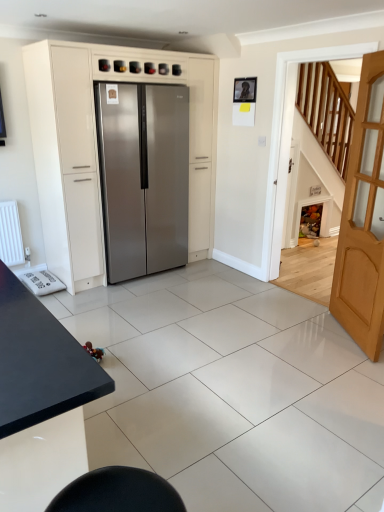
Question: From a real-world perspective, is stainless steel refrigerator at center beneath satin silver refrigerator at center?

Choices:
 (A) yes
 (B) no

Answer: (A)

Question: Could you tell me if stainless steel refrigerator at center is facing satin silver refrigerator at center?

Choices:
 (A) no
 (B) yes

Answer: (B)

Question: Can you confirm if stainless steel refrigerator at center is shorter than satin silver refrigerator at center?

Choices:
 (A) yes
 (B) no

Answer: (A)

Question: Does stainless steel refrigerator at center have a greater width compared to satin silver refrigerator at center?

Choices:
 (A) no
 (B) yes

Answer: (B)

Question: Does stainless steel refrigerator at center come behind satin silver refrigerator at center?

Choices:
 (A) no
 (B) yes

Answer: (B)

Question: Would you say stainless steel refrigerator at center is outside satin silver refrigerator at center?

Choices:
 (A) yes
 (B) no

Answer: (B)

Question: Is satin silver refrigerator at center not within light brown wooden door at right?

Choices:
 (A) no
 (B) yes

Answer: (B)

Question: Could you tell me if satin silver refrigerator at center is turned towards light brown wooden door at right?

Choices:
 (A) yes
 (B) no

Answer: (A)

Question: From a real-world perspective, is satin silver refrigerator at center on top of light brown wooden door at right?

Choices:
 (A) yes
 (B) no

Answer: (A)

Question: Is satin silver refrigerator at center oriented away from light brown wooden door at right?

Choices:
 (A) yes
 (B) no

Answer: (B)

Question: Does satin silver refrigerator at center have a lesser width compared to light brown wooden door at right?

Choices:
 (A) yes
 (B) no

Answer: (B)

Question: From a real-world perspective, does satin silver refrigerator at center sit lower than light brown wooden door at right?

Choices:
 (A) yes
 (B) no

Answer: (B)

Question: Is light brown wooden door at right smaller than satin silver refrigerator at center?

Choices:
 (A) no
 (B) yes

Answer: (B)